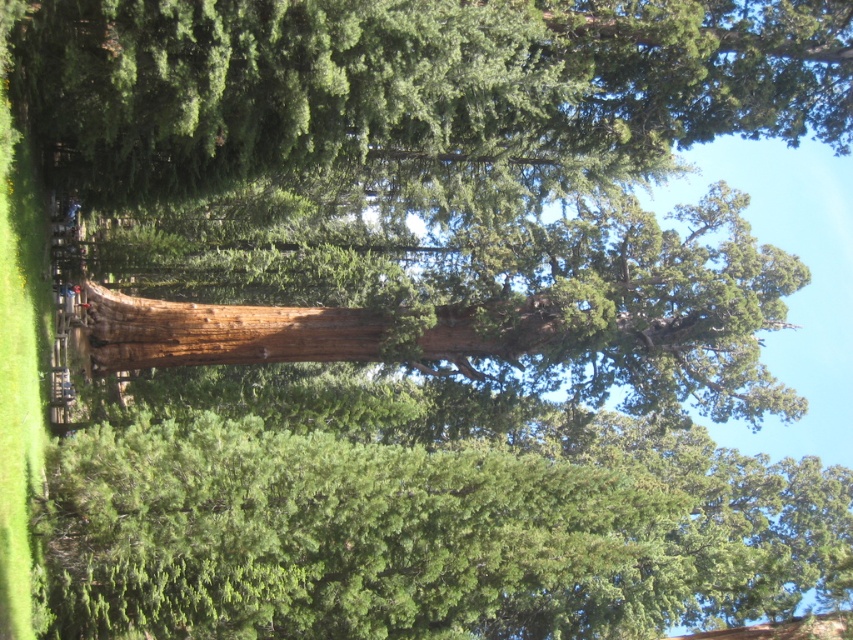
You are a hiker who wants to determine which object is taller between the green rough bark tree at center and the brown rough log at center. Based on the scene description, which one is taller?

The green rough bark tree at center is taller than the brown rough log at center.

You are a hiker who wants to take a photo of both the green rough bark tree at center and the smooth brown tree trunk at center. Since you have a camera with a limited zoom range, you need to know which tree is taller to frame your shot properly. Can you tell me which one is taller?

The green rough bark tree at center is much taller than the smooth brown tree trunk at center, so you should frame your shot to accommodate its height.

You are standing in front of the large tree and want to place a small bench between the two points, point (45,509) and point (276,308). Which point should the bench be closer to in order to be nearer to the tree trunk?

The bench should be closer to point (45,509) because it is nearer to the viewer, and thus closer to the tree trunk compared to point (276,308).